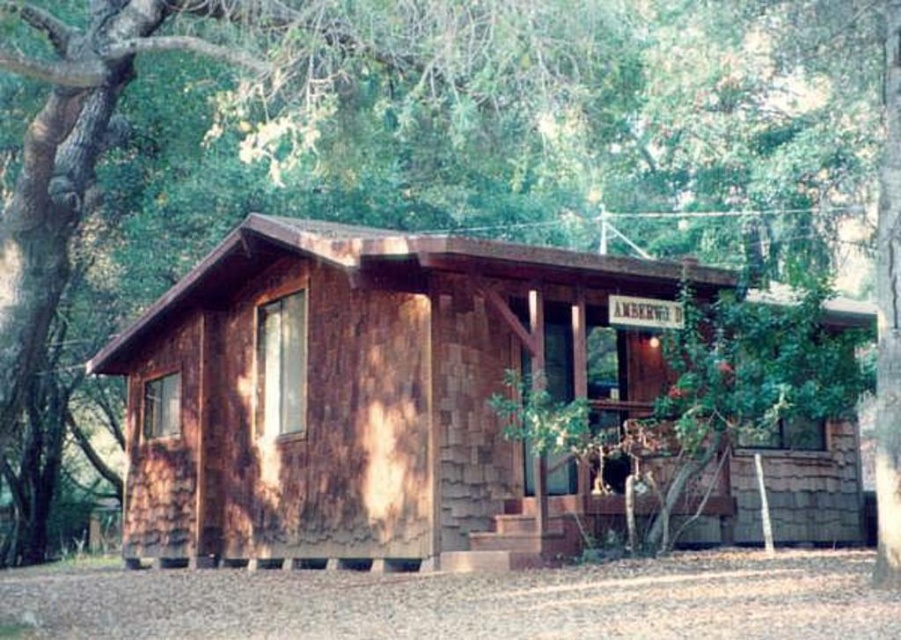
Question: Is green leafy tree at upper center further to camera compared to weathered wood cabin at center?

Choices:
 (A) no
 (B) yes

Answer: (A)

Question: Which point is closer to the camera?

Choices:
 (A) (262, 268)
 (B) (237, 216)

Answer: (A)

Question: Does green leafy tree at upper center appear on the left side of weathered wood cabin at center?

Choices:
 (A) yes
 (B) no

Answer: (A)

Question: Can you confirm if green leafy tree at upper center is thinner than weathered wood cabin at center?

Choices:
 (A) no
 (B) yes

Answer: (A)

Question: Which object is farther from the camera taking this photo?

Choices:
 (A) green leafy tree at upper center
 (B) weathered wood cabin at center

Answer: (B)

Question: Which point appears farthest from the camera in this image?

Choices:
 (A) (510, 244)
 (B) (630, 225)

Answer: (B)